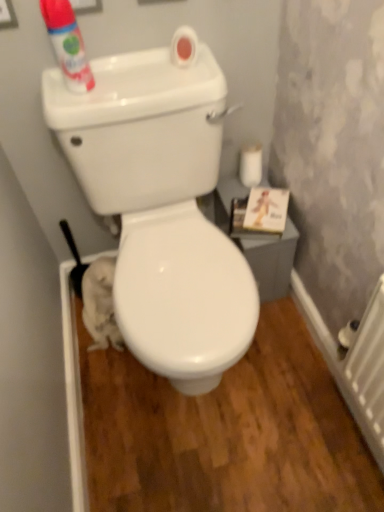
Question: Does white matte toilet paper at right have a lesser width compared to matte white can at upper left?

Choices:
 (A) no
 (B) yes

Answer: (A)

Question: Is white matte toilet paper at right further to camera compared to matte white can at upper left?

Choices:
 (A) yes
 (B) no

Answer: (A)

Question: Does white matte toilet paper at right have a smaller size compared to matte white can at upper left?

Choices:
 (A) no
 (B) yes

Answer: (B)

Question: Is white matte toilet paper at right to the left of matte white can at upper left from the viewer's perspective?

Choices:
 (A) no
 (B) yes

Answer: (A)

Question: Are white matte toilet paper at right and matte white can at upper left making contact?

Choices:
 (A) no
 (B) yes

Answer: (A)

Question: Considering the relative positions of white matte toilet paper at right and white plastic radiator at lower right in the image provided, is white matte toilet paper at right to the left or to the right of white plastic radiator at lower right?

Choices:
 (A) right
 (B) left

Answer: (B)

Question: Looking at the image, does white matte toilet paper at right seem bigger or smaller compared to white plastic radiator at lower right?

Choices:
 (A) small
 (B) big

Answer: (A)

Question: Is white matte toilet paper at right taller or shorter than white plastic radiator at lower right?

Choices:
 (A) tall
 (B) short

Answer: (B)

Question: Considering their positions, is white matte toilet paper at right located in front of or behind white plastic radiator at lower right?

Choices:
 (A) front
 (B) behind

Answer: (B)

Question: Considering the positions of matte white can at upper left and white glossy toilet at center in the image, is matte white can at upper left wider or thinner than white glossy toilet at center?

Choices:
 (A) thin
 (B) wide

Answer: (A)

Question: Considering the relative positions of matte white can at upper left and white glossy toilet at center in the image provided, is matte white can at upper left to the left or to the right of white glossy toilet at center?

Choices:
 (A) right
 (B) left

Answer: (B)

Question: From the image's perspective, relative to white glossy toilet at center, is matte white can at upper left above or below?

Choices:
 (A) below
 (B) above

Answer: (B)

Question: From a real-world perspective, is matte white can at upper left physically located above or below white glossy toilet at center?

Choices:
 (A) above
 (B) below

Answer: (A)

Question: From a real-world perspective, is white matte toilet paper at right positioned above or below matte white can at upper left?

Choices:
 (A) below
 (B) above

Answer: (A)

Question: From the image's perspective, is white matte toilet paper at right located above or below matte white can at upper left?

Choices:
 (A) above
 (B) below

Answer: (B)